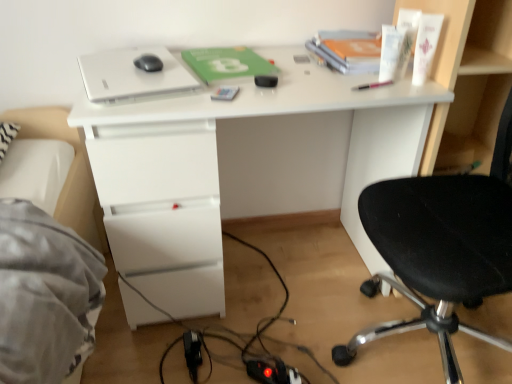
Where is `vacant space that is in between white matte book at upper right and metallic silver phone at center, the first stationery from the left`? The image size is (512, 384). vacant space that is in between white matte book at upper right and metallic silver phone at center, the first stationery from the left is located at coordinates (297, 73).